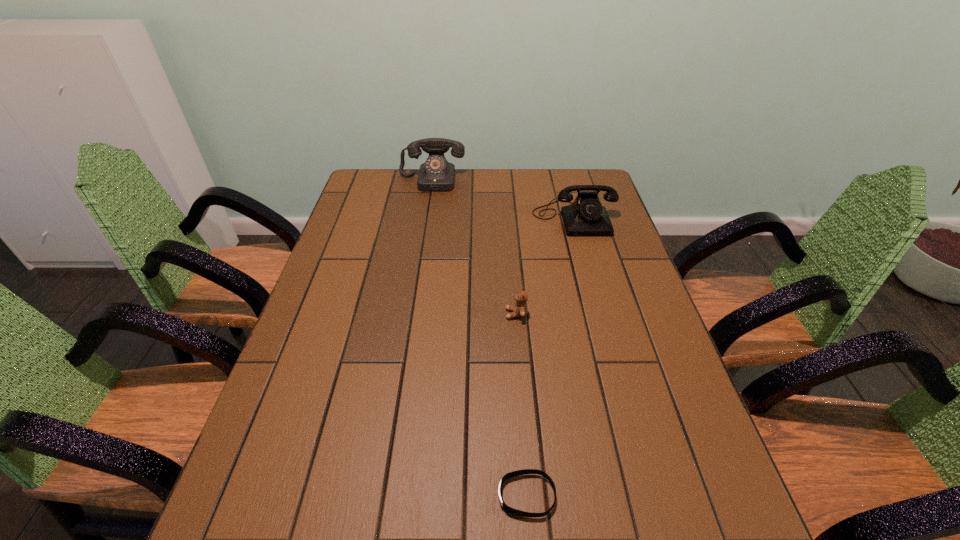
This screenshot has width=960, height=540. What are the coordinates of `free region at the far edge of the desktop` in the screenshot? It's located at (456, 193).

Locate an element on the screen. The height and width of the screenshot is (540, 960). free location at the left edge is located at coordinates (373, 289).

What are the coordinates of `vacant space at the right edge of the desktop` in the screenshot? It's located at (710, 477).

The width and height of the screenshot is (960, 540). In order to click on vacant area at the far left corner of the desktop in this screenshot , I will do `click(365, 181)`.

Locate an element on the screen. The width and height of the screenshot is (960, 540). vacant area that lies between the tallest object and the teddy bear is located at coordinates (474, 247).

Locate an element on the screen. free spot between the third shortest object and the nearest object is located at coordinates (550, 357).

Where is `empty location between the left telephone and the shorter telephone`? empty location between the left telephone and the shorter telephone is located at coordinates (503, 199).

The height and width of the screenshot is (540, 960). Identify the location of free space between the wristband and the left telephone. (479, 338).

Locate an element on the screen. The width and height of the screenshot is (960, 540). vacant area that lies between the third tallest object and the leftmost object is located at coordinates (474, 247).

The image size is (960, 540). I want to click on blank region between the third tallest object and the tallest object, so click(x=474, y=247).